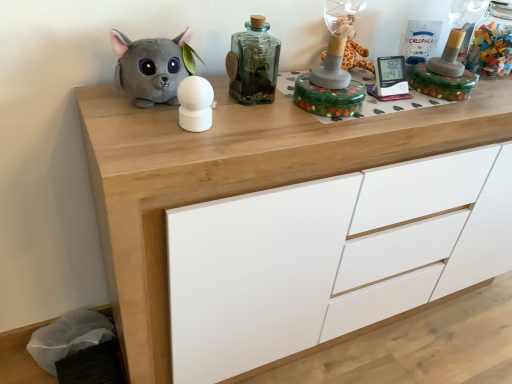
Identify the location of vacant space that's between white matte sphere at center, which is the 2th toy from right to left, and gray plush toy at left, the third toy in the right-to-left sequence. (x=170, y=121).